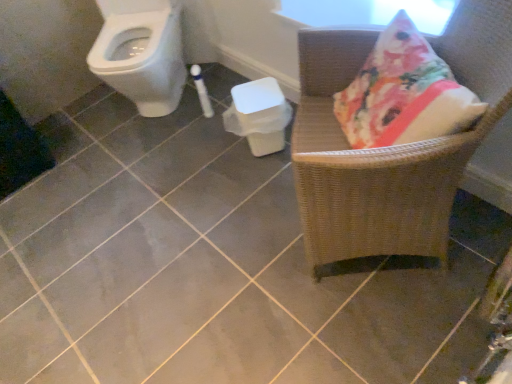
Where is `vacant area that is in front of white glossy toilet at upper left`? vacant area that is in front of white glossy toilet at upper left is located at coordinates pos(155,158).